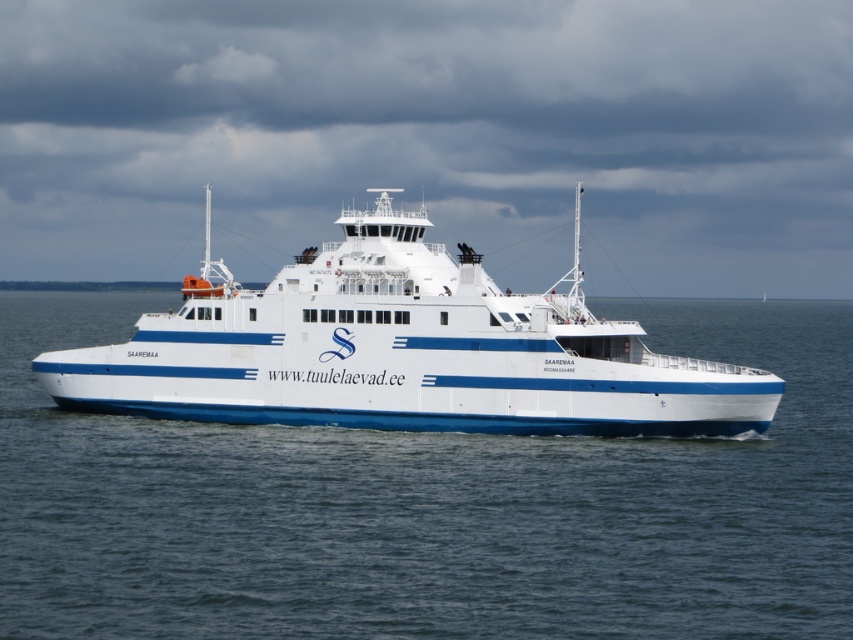
You are standing on the ferry boat named Saaremaa and looking around. Where is the blue water at center located in terms of coordinates?

The blue water at center is located at coordinates point (428,506).